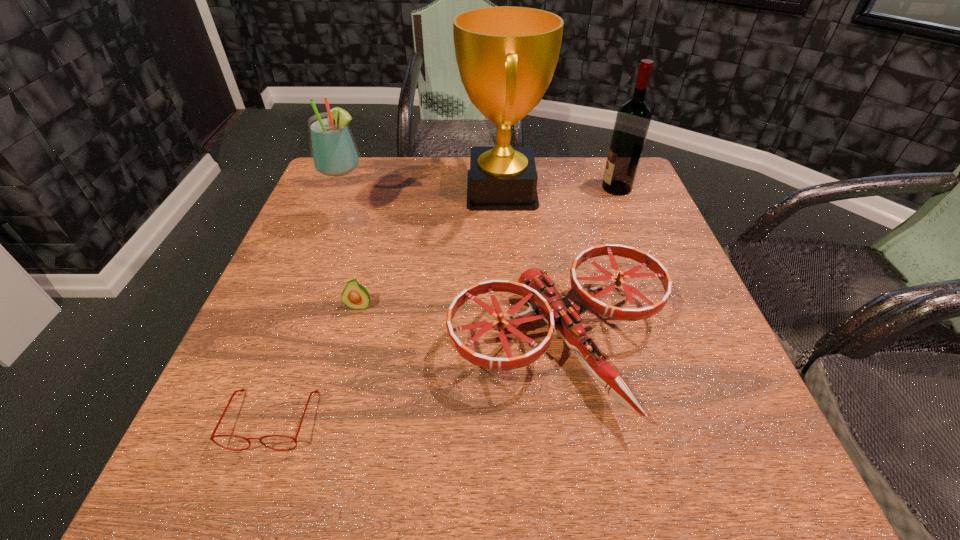
At what (x,y) coordinates should I click in order to perform the action: click on free point between the shortest object and the farther alcohol. Please return your answer as a coordinate pair (x, y). The width and height of the screenshot is (960, 540). Looking at the image, I should click on (444, 303).

Where is `free space between the spectacles and the nearer alcohol`? This screenshot has width=960, height=540. free space between the spectacles and the nearer alcohol is located at coordinates (312, 320).

Locate an element on the screen. Image resolution: width=960 pixels, height=540 pixels. vacant point located between the award and the drone is located at coordinates (531, 268).

Find the location of a particular element. The height and width of the screenshot is (540, 960). vacant space that's between the fourth tallest object and the right alcohol is located at coordinates (588, 267).

This screenshot has height=540, width=960. Find the location of `vacant space in between the shortest object and the farther alcohol`. vacant space in between the shortest object and the farther alcohol is located at coordinates (444, 303).

This screenshot has width=960, height=540. What are the coordinates of `free area in between the left alcohol and the fourth tallest object` in the screenshot? It's located at (456, 283).

Where is `free space between the drone and the fifth tallest object`? free space between the drone and the fifth tallest object is located at coordinates (459, 326).

At what (x,y) coordinates should I click in order to perform the action: click on free space between the second shortest object and the nearer alcohol. Please return your answer as a coordinate pair (x, y). The width and height of the screenshot is (960, 540). Looking at the image, I should click on (356, 264).

The image size is (960, 540). In order to click on object identified as the fifth closest to the drone in this screenshot , I will do `click(633, 118)`.

This screenshot has width=960, height=540. In order to click on object that can be found as the second closest to the second shortest object in this screenshot , I will do click(x=242, y=390).